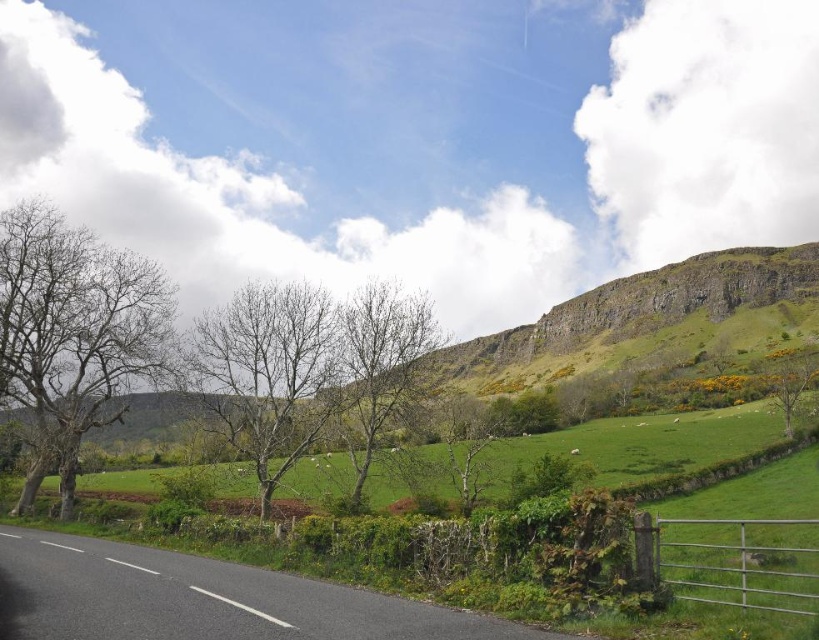
You are standing at the center of the paved road and want to take a photo of the bare branches at left. Which direction should you face to capture them in your camera view?

The bare branches at left are located to the left side of the road, so you should face towards the left direction to capture them in your camera view.

You are a bird looking for a place to perch. You see two sets of bare branches at left and bare branches at center. Which one is located more to the left?

The bare branches at left is more to the left than the bare branches at center.